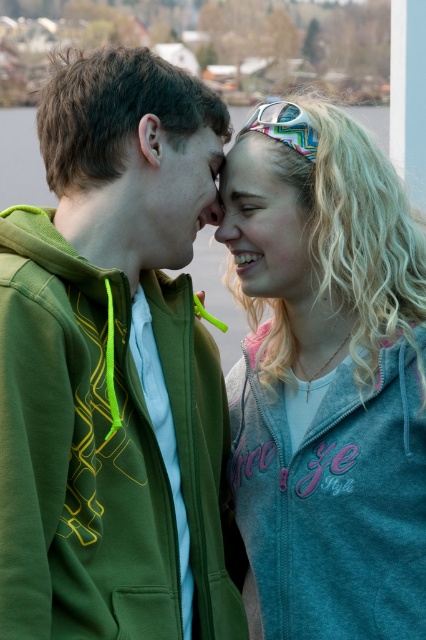
Which is above, matte green hoodie at center or smooth skin nose at center?

matte green hoodie at center is above.

Can you confirm if matte green hoodie at center is positioned to the left of smooth skin nose at center?

Yes, matte green hoodie at center is to the left of smooth skin nose at center.

Who is more forward, (164, 218) or (238, 230)?

Point (164, 218)

Locate an element on the screen. matte green hoodie at center is located at coordinates (184, 193).

Consider the image. Is gray fleece jacket at right wider than translucent plastic goggles at upper center?

Indeed, gray fleece jacket at right has a greater width compared to translucent plastic goggles at upper center.

Which is behind, point (259, 548) or point (296, 147)?

Point (259, 548)

This screenshot has height=640, width=426. In order to click on gray fleece jacket at right in this screenshot , I will do `click(328, 387)`.

Does green fleece jacket at left have a lesser width compared to gray fleece jacket at right?

In fact, green fleece jacket at left might be wider than gray fleece jacket at right.

Which is behind, point (195, 177) or point (376, 593)?

Point (195, 177)

This screenshot has width=426, height=640. What do you see at coordinates (115, 369) in the screenshot?
I see `green fleece jacket at left` at bounding box center [115, 369].

Image resolution: width=426 pixels, height=640 pixels. What are the coordinates of `green fleece jacket at left` in the screenshot? It's located at (115, 369).